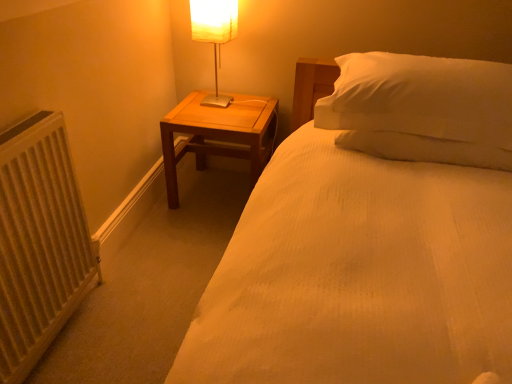
Question: From a real-world perspective, is wooden nightstand at center located beneath white textured radiator at left?

Choices:
 (A) no
 (B) yes

Answer: (B)

Question: Does wooden nightstand at center have a lesser height compared to white textured radiator at left?

Choices:
 (A) yes
 (B) no

Answer: (A)

Question: Is wooden nightstand at center at the left side of white textured radiator at left?

Choices:
 (A) yes
 (B) no

Answer: (B)

Question: Does wooden nightstand at center come behind white textured radiator at left?

Choices:
 (A) yes
 (B) no

Answer: (A)

Question: From the image's perspective, is wooden nightstand at center over white textured radiator at left?

Choices:
 (A) no
 (B) yes

Answer: (B)

Question: Is wooden nightstand at center to the right of white textured radiator at left from the viewer's perspective?

Choices:
 (A) yes
 (B) no

Answer: (A)

Question: Would you consider wooden nightstand at center to be distant from white fabric-covered lamp at upper left?

Choices:
 (A) yes
 (B) no

Answer: (B)

Question: From the image's perspective, is wooden nightstand at center under white fabric-covered lamp at upper left?

Choices:
 (A) no
 (B) yes

Answer: (B)

Question: Is the position of wooden nightstand at center less distant than that of white fabric-covered lamp at upper left?

Choices:
 (A) no
 (B) yes

Answer: (A)

Question: Is wooden nightstand at center facing away from white fabric-covered lamp at upper left?

Choices:
 (A) yes
 (B) no

Answer: (B)

Question: Is wooden nightstand at center at the right side of white fabric-covered lamp at upper left?

Choices:
 (A) yes
 (B) no

Answer: (A)

Question: Is wooden nightstand at center wider than white fabric-covered lamp at upper left?

Choices:
 (A) no
 (B) yes

Answer: (B)

Question: From a real-world perspective, is white textured radiator at left over white fabric-covered lamp at upper left?

Choices:
 (A) yes
 (B) no

Answer: (B)